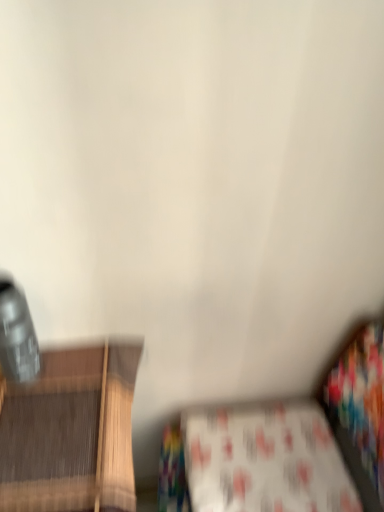
Question: Is white fabric couch at lower right positioned in front of white printed fabric at lower center?

Choices:
 (A) yes
 (B) no

Answer: (A)

Question: Is white fabric couch at lower right facing towards white printed fabric at lower center?

Choices:
 (A) yes
 (B) no

Answer: (A)

Question: Can you confirm if white fabric couch at lower right is positioned to the right of white printed fabric at lower center?

Choices:
 (A) yes
 (B) no

Answer: (B)

Question: Is the depth of white fabric couch at lower right greater than that of white printed fabric at lower center?

Choices:
 (A) yes
 (B) no

Answer: (B)

Question: Can you confirm if white fabric couch at lower right is thinner than white printed fabric at lower center?

Choices:
 (A) yes
 (B) no

Answer: (B)

Question: From a real-world perspective, is white fabric couch at lower right physically above white printed fabric at lower center?

Choices:
 (A) yes
 (B) no

Answer: (B)

Question: Is white printed fabric at lower center directly adjacent to white fabric couch at lower right?

Choices:
 (A) no
 (B) yes

Answer: (B)

Question: Is white printed fabric at lower center at the right side of white fabric couch at lower right?

Choices:
 (A) no
 (B) yes

Answer: (B)

Question: Is white printed fabric at lower center positioned with its back to white fabric couch at lower right?

Choices:
 (A) yes
 (B) no

Answer: (A)

Question: Considering the relative positions of white printed fabric at lower center and white fabric couch at lower right in the image provided, is white printed fabric at lower center to the left of white fabric couch at lower right from the viewer's perspective?

Choices:
 (A) no
 (B) yes

Answer: (A)

Question: From the image's perspective, is white printed fabric at lower center on white fabric couch at lower right?

Choices:
 (A) yes
 (B) no

Answer: (A)

Question: Is white printed fabric at lower center bigger than white fabric couch at lower right?

Choices:
 (A) yes
 (B) no

Answer: (B)

Question: From their relative heights in the image, would you say white printed fabric at lower center is taller or shorter than white fabric couch at lower right?

Choices:
 (A) short
 (B) tall

Answer: (A)